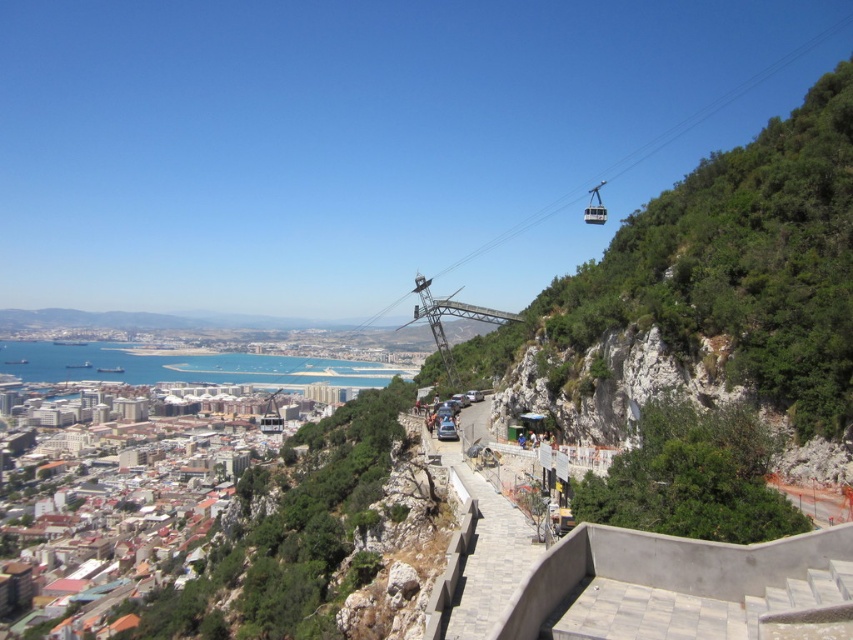
Identify the location of metallic cable car at upper center. (595, 205).

Who is positioned more to the left, metallic cable car at upper center or metallic cable car at center?

From the viewer's perspective, metallic cable car at center appears more on the left side.

Is point (602, 221) behind point (445, 432)?

Yes, point (602, 221) is farther from viewer.

Find the location of `metallic cable car at upper center`. metallic cable car at upper center is located at coordinates (595, 205).